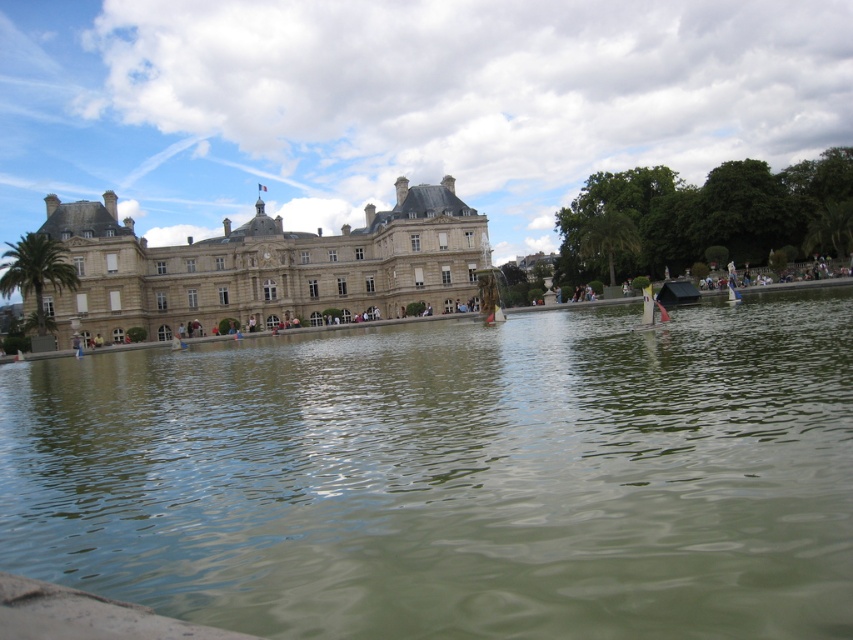
Between point (554, 496) and point (55, 310), which one is positioned in front?

Positioned in front is point (554, 496).

Is greenish water at center shorter than brown stone palace at center?

Yes, greenish water at center is shorter than brown stone palace at center.

Is point (13, 394) in front of point (306, 291)?

Yes, point (13, 394) is in front of point (306, 291).

Locate an element on the screen. greenish water at center is located at coordinates (454, 476).